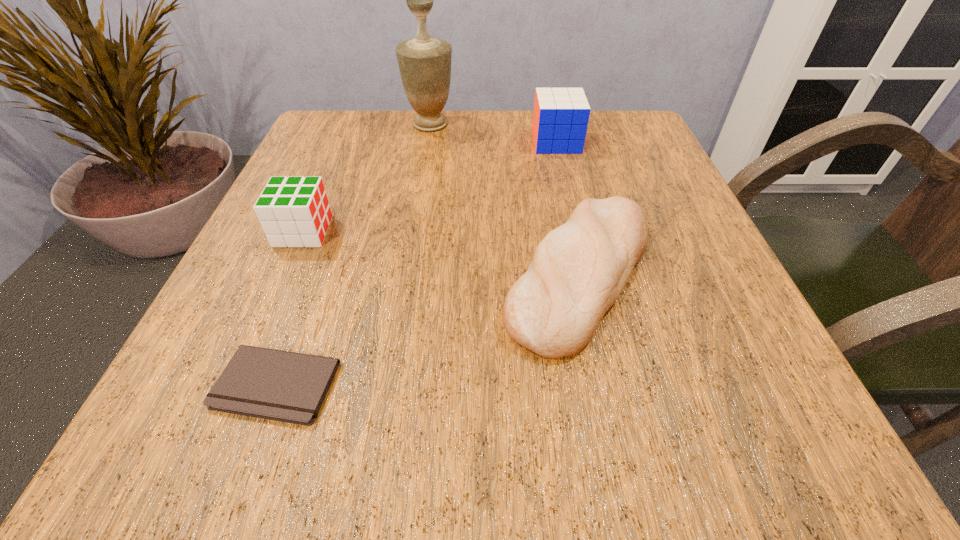
Identify the location of vacant space located 0.180m on the red face of the left cube. This screenshot has height=540, width=960. (433, 232).

Identify the location of free spot located 0.140m on the front of the bread. The image size is (960, 540). (624, 474).

Find the location of a particular element. The width and height of the screenshot is (960, 540). vacant space located on the right of the shortest object is located at coordinates (537, 385).

At what (x,y) coordinates should I click in order to perform the action: click on urn that is at the far edge. Please return your answer as a coordinate pair (x, y). The height and width of the screenshot is (540, 960). Looking at the image, I should click on [425, 63].

Identify the location of cube located at the far edge. The width and height of the screenshot is (960, 540). (560, 119).

Identify the location of object that is at the near edge. Image resolution: width=960 pixels, height=540 pixels. (272, 384).

Identify the location of cube located at the left edge. This screenshot has height=540, width=960. (295, 212).

Locate an element on the screen. Image resolution: width=960 pixels, height=540 pixels. checkbook that is at the left edge is located at coordinates (272, 384).

The height and width of the screenshot is (540, 960). In order to click on cube located at the right edge in this screenshot , I will do `click(560, 119)`.

I want to click on bread at the right edge, so click(x=578, y=271).